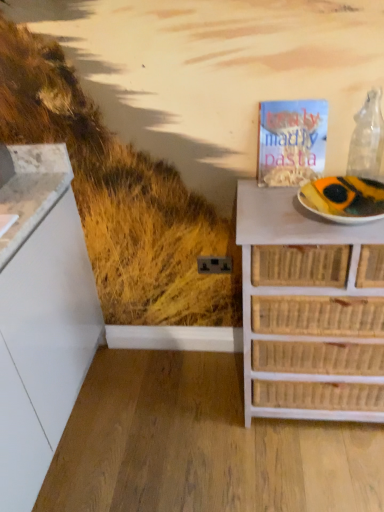
You are a GUI agent. You are given a task and a screenshot of the screen. Output one action in this format:
    pyautogui.click(x=<x>, y=<y>)
    Task: Click on the vacant area situated to the left side of matte paper magazine at upper right
    This screenshot has height=512, width=384.
    Given the screenshot: What is the action you would take?
    pyautogui.click(x=251, y=190)